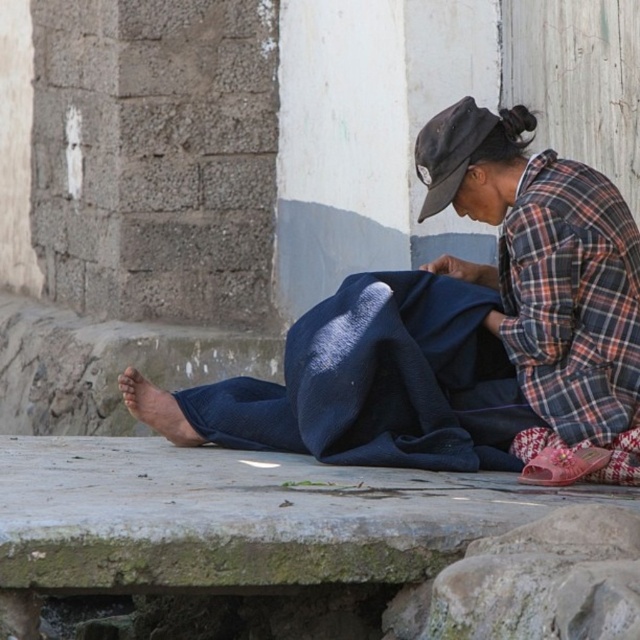
You are a tailor trying to determine which fabric is more suitable for making a large tablecloth. Based on the scene, which fabric between the matte blue fabric at center and the plaid fabric at lower right is taller and thus more appropriate for the task?

The matte blue fabric at center is much taller than the plaid fabric at lower right, making it more suitable for creating a large tablecloth.

Consider the image. You are standing at the camera position and want to hand the matte blue fabric at center to someone across the street. The street is 10 meters wide. Can you reach the fabric from where you are?

The matte blue fabric at center and camera are 8.07 meters apart from each other, so you can reach the fabric since it is within the 10 meters width of the street.